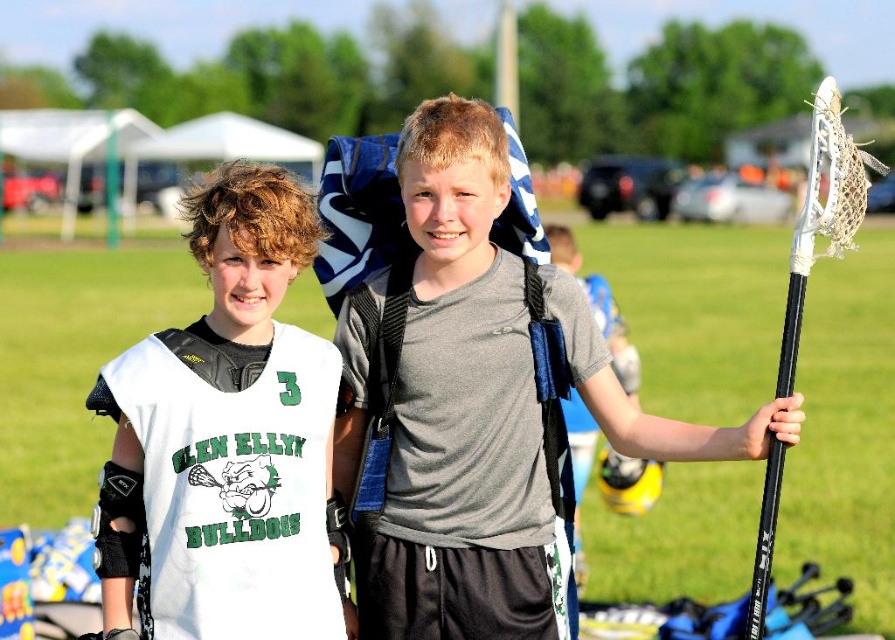
You are a photographer trying to capture a closeup shot of the gray matte shirt at center and the black matte lacrosse stick at right. Given that your camera has a maximum focus range of 2 meters, will you be able to capture both objects in the same frame without moving the camera?

The gray matte shirt at center is 2.02 meters from the black matte lacrosse stick at right, which is slightly beyond the camera maximum focus range of 2 meters. Therefore, you cannot capture both objects in the same frame without moving the camera.

You are a photographer standing at the camera position. You want to take a closeup shot of the lacrosse stick held by the boy on the right. The focal length of your camera is set to 50mm. If you want to maintain the same framing but get a closer shot without moving the camera, what should you adjust? Consider the position of the point at (x=198, y=496) which is 7.15 meters away from the camera.

To get a closer shot of the lacrosse stick held by the boy on the right without moving the camera, you need to increase the focal length of your camera lens. Since the point at (x=198, y=496) is 7.15 meters away, a longer focal length will magnify the subject while keeping the camera position fixed.